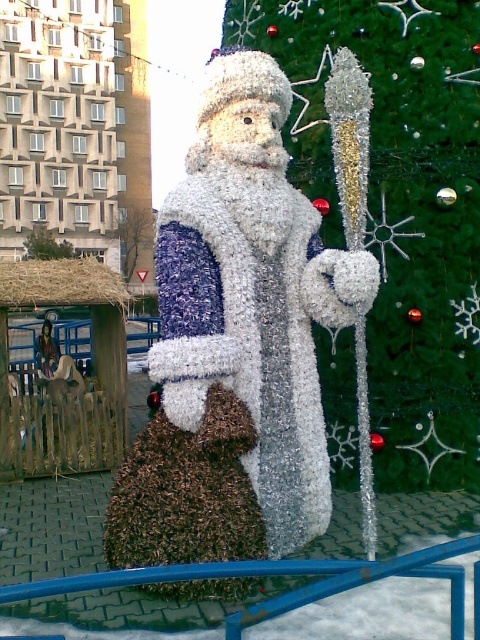
Question: Is shiny metallic santa claus at center to the right of green shiny christmas tree at center from the viewer's perspective?

Choices:
 (A) no
 (B) yes

Answer: (A)

Question: Which of the following is the closest to the observer?

Choices:
 (A) blue metallic rail at center
 (B) green shiny christmas tree at center
 (C) shiny metallic santa claus at center

Answer: (A)

Question: Is green shiny christmas tree at center smaller than blue metallic rail at center?

Choices:
 (A) yes
 (B) no

Answer: (B)

Question: Which point is closer to the camera taking this photo?

Choices:
 (A) (350, 470)
 (B) (295, 628)
 (C) (207, 529)

Answer: (B)

Question: Which is farther from the blue metallic rail at center?

Choices:
 (A) green shiny christmas tree at center
 (B) shiny metallic santa claus at center

Answer: (A)

Question: Can you confirm if shiny metallic santa claus at center is wider than green shiny christmas tree at center?

Choices:
 (A) yes
 (B) no

Answer: (B)